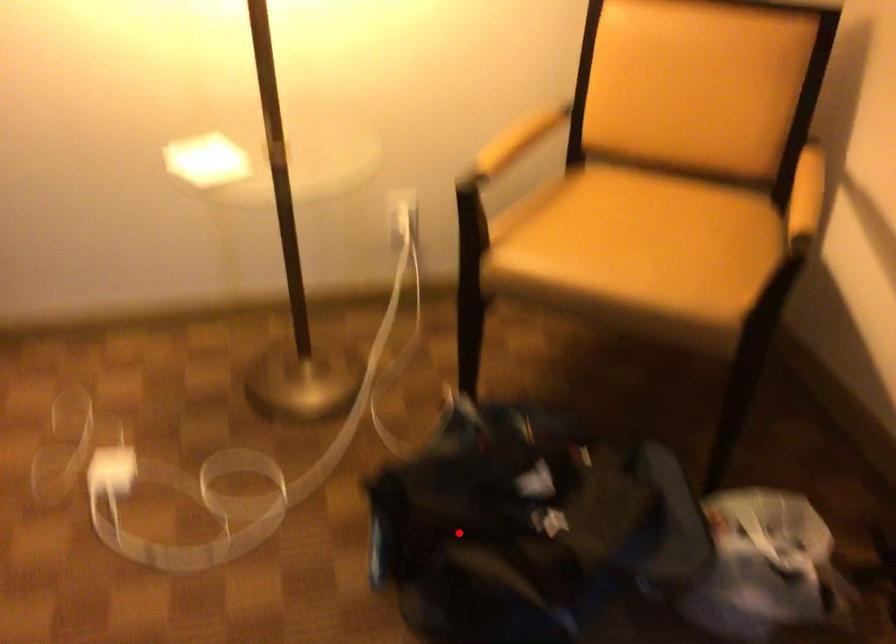
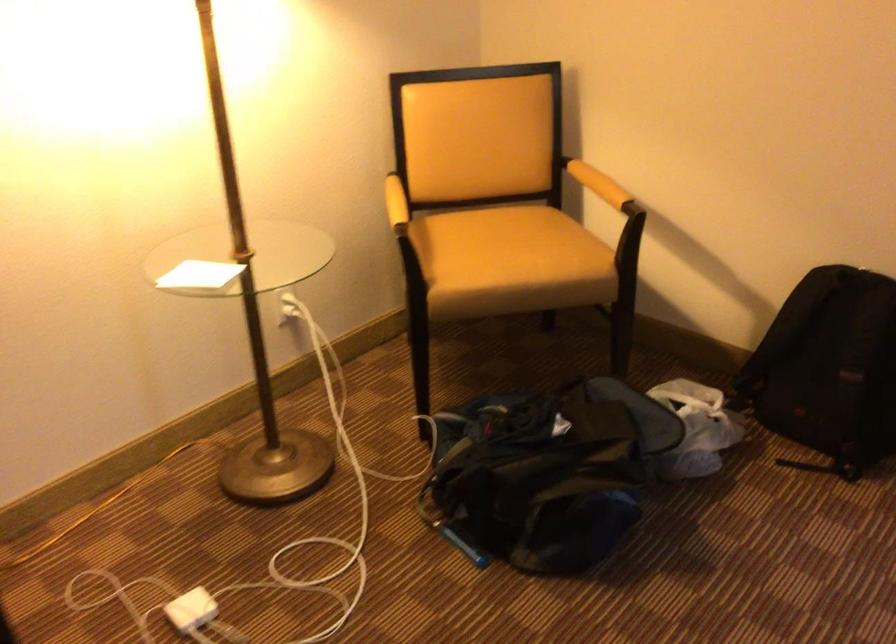
Question: A red point is marked in image1. In image2, is the corresponding 3D point closer to the camera or farther? Reply with the corresponding letter.

Choices:
 (A) The corresponding 3D point is closer.
 (B) The corresponding 3D point is farther.

Answer: (B)